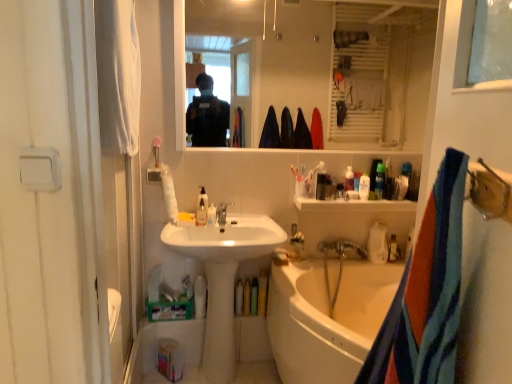
In order to face white glossy bathtub at lower center, should I rotate leftwards or rightwards?

You should rotate right by 15.749 degrees.

How much space does translucent plastic soap dispenser at sink, placed as the 1th bottle when sorted from front to back, occupy horizontally?

The width of translucent plastic soap dispenser at sink, placed as the 1th bottle when sorted from front to back, is 1.76 inches.

The width and height of the screenshot is (512, 384). What do you see at coordinates (170, 310) in the screenshot?
I see `green cardboard box at lower center` at bounding box center [170, 310].

This screenshot has height=384, width=512. What do you see at coordinates (326, 65) in the screenshot?
I see `clear glass mirror at upper center` at bounding box center [326, 65].

Identify the location of white matte bottle at lower right, which is the second bottle in left-to-right order. (377, 244).

Where is `white glossy bathtub at lower center`? This screenshot has height=384, width=512. white glossy bathtub at lower center is located at coordinates (327, 319).

From a real-world perspective, which object stands above the other?

From a 3D spatial view, translucent plastic bottle at upper center, which is the 3th toiletry in left-to-right order, is above.

From the image's perspective, is translucent plastic bottle at upper center, the 3th toiletry positioned from the right, under translucent plastic soap at lower right, the third bottle in the front-to-back sequence?

No.

This screenshot has height=384, width=512. What are the coordinates of `toiletry that is the 4th one when counting upward from the translucent plastic soap at lower right, the 1th bottle viewed from the right (from the image's perspective)` in the screenshot? It's located at (349, 179).

Can we say translucent plastic bottle at upper center, the 3th toiletry positioned from the right, lies outside translucent plastic soap at lower right, which is the 1th bottle in back-to-front order?

Yes, translucent plastic bottle at upper center, the 3th toiletry positioned from the right, is not within translucent plastic soap at lower right, which is the 1th bottle in back-to-front order.

Is the depth of translucent plastic cup at upper center, the fourth toiletry in the right-to-left sequence, less than that of translucent plastic soap dispenser at center, the 1th toiletry when ordered from left to right?

No.

Measure the distance from translucent plastic cup at upper center, arranged as the second toiletry when viewed from the left, to translucent plastic soap dispenser at center, the 1th toiletry when ordered from left to right.

translucent plastic cup at upper center, arranged as the second toiletry when viewed from the left, and translucent plastic soap dispenser at center, the 1th toiletry when ordered from left to right, are 59.94 centimeters apart from each other.

Is translucent plastic cup at upper center, arranged as the second toiletry when viewed from the left, not inside translucent plastic soap dispenser at center, which is the 5th toiletry from right to left?

translucent plastic cup at upper center, arranged as the second toiletry when viewed from the left, lies outside translucent plastic soap dispenser at center, which is the 5th toiletry from right to left,'s area.

Would you say translucent plastic cup at upper center, arranged as the second toiletry when viewed from the left, is to the left or to the right of translucent plastic soap dispenser at center, which is the 5th toiletry from right to left, in the picture?

In the image, translucent plastic cup at upper center, arranged as the second toiletry when viewed from the left, appears on the right side of translucent plastic soap dispenser at center, which is the 5th toiletry from right to left.

Is white fabric screen door at left positioned beyond the bounds of translucent plastic bottle at upper center, the 3th toiletry positioned from the right?

white fabric screen door at left lies outside translucent plastic bottle at upper center, the 3th toiletry positioned from the right,'s area.

Looking at this image, is white fabric screen door at left wider than translucent plastic bottle at upper center, which is the 3th toiletry in left-to-right order?

Yes, white fabric screen door at left is wider than translucent plastic bottle at upper center, which is the 3th toiletry in left-to-right order.

From the image's perspective, which toiletry is the 1st one above the white fabric screen door at left? Please provide its 2D coordinates.

[(349, 179)]

From a real-world perspective, who is located higher, white fabric screen door at left or translucent plastic bottle at upper center, the 3th toiletry positioned from the right?

In real-world perspective, white fabric screen door at left is above.

Considering the relative sizes of translucent plastic bottles at upper right, the 1th toiletry in the right-to-left sequence, and translucent plastic soap at lower right, the 1th bottle viewed from the right, in the image provided, is translucent plastic bottles at upper right, the 1th toiletry in the right-to-left sequence, taller than translucent plastic soap at lower right, the 1th bottle viewed from the right,?

Yes, translucent plastic bottles at upper right, the 1th toiletry in the right-to-left sequence, is taller than translucent plastic soap at lower right, the 1th bottle viewed from the right.

Is translucent plastic bottles at upper right, which appears as the fifth toiletry when viewed from the left, situated inside translucent plastic soap at lower right, which is the 3th bottle from left to right, or outside?

translucent plastic bottles at upper right, which appears as the fifth toiletry when viewed from the left, lies outside translucent plastic soap at lower right, which is the 3th bottle from left to right.

Is translucent plastic bottles at upper right, the 1th toiletry in the right-to-left sequence, next to translucent plastic soap at lower right, which is the 1th bottle in back-to-front order, and touching it?

No, translucent plastic bottles at upper right, the 1th toiletry in the right-to-left sequence, is not touching translucent plastic soap at lower right, which is the 1th bottle in back-to-front order.

Does translucent plastic bottles at upper right, which appears as the fifth toiletry when viewed from the left, appear on the right side of translucent plastic soap at lower right, the 1th bottle viewed from the right?

Incorrect, translucent plastic bottles at upper right, which appears as the fifth toiletry when viewed from the left, is not on the right side of translucent plastic soap at lower right, the 1th bottle viewed from the right.

Does white plastic shelf at upper center have a greater height compared to translucent plastic soap at lower right, which is the 1th bottle in back-to-front order?

No.

Based on the photo, considering the relative positions of white plastic shelf at upper center and translucent plastic soap at lower right, the 1th bottle viewed from the right, in the image provided, is white plastic shelf at upper center to the right of translucent plastic soap at lower right, the 1th bottle viewed from the right, from the viewer's perspective?

In fact, white plastic shelf at upper center is to the left of translucent plastic soap at lower right, the 1th bottle viewed from the right.

Where is `cabinetry that is above the translucent plastic soap at lower right, which is the 3th bottle from left to right (from the image's perspective)`? cabinetry that is above the translucent plastic soap at lower right, which is the 3th bottle from left to right (from the image's perspective) is located at coordinates (354, 205).

Is white plastic shelf at upper center bigger than translucent plastic soap at lower right, the 1th bottle viewed from the right?

Yes, white plastic shelf at upper center is bigger than translucent plastic soap at lower right, the 1th bottle viewed from the right.

From a real-world perspective, relative to white glossy faucet at center, is clear glass mirror at upper center vertically above or below?

From a real-world perspective, clear glass mirror at upper center is physically above white glossy faucet at center.

Based on the photo, is clear glass mirror at upper center oriented towards white glossy faucet at center?

No, clear glass mirror at upper center is not facing towards white glossy faucet at center.

Is clear glass mirror at upper center taller or shorter than white glossy faucet at center?

Clearly, clear glass mirror at upper center is taller compared to white glossy faucet at center.

What's the angular difference between white plastic shelf at upper center and blue striped towel at right, which appears as the 2th towel/napkin when viewed from the left,'s facing directions?

The angular difference between white plastic shelf at upper center and blue striped towel at right, which appears as the 2th towel/napkin when viewed from the left, is 101 degrees.

From the image's perspective, is white plastic shelf at upper center over blue striped towel at right, the 2th towel/napkin when ordered from back to front?

Yes, from the image's perspective, white plastic shelf at upper center is on top of blue striped towel at right, the 2th towel/napkin when ordered from back to front.

Is white plastic shelf at upper center not inside blue striped towel at right, the 2th towel/napkin when ordered from back to front?

Yes.

Would you consider white plastic shelf at upper center to be distant from blue striped towel at right, which appears as the 2th towel/napkin when viewed from the left?

That's right, there is a large distance between white plastic shelf at upper center and blue striped towel at right, which appears as the 2th towel/napkin when viewed from the left.

Locate an element on the screen. The height and width of the screenshot is (384, 512). the 2nd bottle behind the translucent plastic bottle at upper center, the 3th toiletry positioned from the right, counting from the anchor's position is located at coordinates tap(392, 249).

Where is `toiletry on the left of the translucent plastic cup at upper center, the fourth toiletry in the right-to-left sequence`? toiletry on the left of the translucent plastic cup at upper center, the fourth toiletry in the right-to-left sequence is located at coordinates (211, 214).

Based on their spatial positions, is white glossy faucet at center or white glossy sink at center closer to translucent plastic bottle at upper center, which is the 3th toiletry in left-to-right order?

white glossy faucet at center lies closer to translucent plastic bottle at upper center, which is the 3th toiletry in left-to-right order, than the other object.

Which object lies nearer to the anchor point white plastic bottle at upper center, arranged as the 2th toiletry when viewed from the right, green cardboard box at lower center or white fabric towel at left, which is counted as the 1th towel/napkin, starting from the top?

green cardboard box at lower center.

Based on their spatial positions, is white plastic shelf at upper center or translucent plastic soap at lower right, the 1th bottle viewed from the right, further from white fabric towel at left, which is counted as the 1th towel/napkin, starting from the top?

translucent plastic soap at lower right, the 1th bottle viewed from the right, is positioned further to the anchor white fabric towel at left, which is counted as the 1th towel/napkin, starting from the top.

When comparing their distances from white matte bottle at lower right, which ranks as the 2th bottle in right-to-left order, does translucent plastic bottle at upper center, the 3th toiletry positioned from the right, or green cardboard box at lower center seem closer?

The object closer to white matte bottle at lower right, which ranks as the 2th bottle in right-to-left order, is translucent plastic bottle at upper center, the 3th toiletry positioned from the right.

Estimate the real-world distances between objects in this image. Which object is further from white glossy sink at center, green cardboard box at lower center or white plastic shelf at upper center?

white plastic shelf at upper center.

Based on their spatial positions, is translucent plastic cup at upper center, arranged as the second toiletry when viewed from the left, or translucent plastic soap dispenser at center, the 1th toiletry when ordered from left to right, closer to white fabric towel at left, which ranks as the first towel/napkin in left-to-right order?

translucent plastic soap dispenser at center, the 1th toiletry when ordered from left to right, is closer to white fabric towel at left, which ranks as the first towel/napkin in left-to-right order.

Which object lies nearer to the anchor point white plastic bottle at upper center, arranged as the 2th toiletry when viewed from the right, white fabric towel at left, arranged as the 2th towel/napkin when ordered from the bottom, or translucent plastic soap dispenser at sink, marked as the first bottle in a left-to-right arrangement?

Based on the image, translucent plastic soap dispenser at sink, marked as the first bottle in a left-to-right arrangement, appears to be nearer to white plastic bottle at upper center, arranged as the 2th toiletry when viewed from the right.

Based on the photo, based on their spatial positions, is white glossy faucet at center or white fabric towel at left, arranged as the first towel/napkin when viewed from the back, further from clear glass mirror at upper center?

white fabric towel at left, arranged as the first towel/napkin when viewed from the back.

Locate an element on the screen. cabinetry located between translucent plastic cup at upper center, arranged as the second toiletry when viewed from the left, and translucent plastic soap at lower right, the 1th bottle viewed from the right, in the left-right direction is located at coordinates [x=354, y=205].

The image size is (512, 384). What are the coordinates of `sink between blue striped towel at right, the 2th towel/napkin when ordered from back to front, and translucent plastic soap dispenser at center, which is the 5th toiletry from right to left, along the z-axis` in the screenshot? It's located at (223, 277).

Where is `toiletry between translucent plastic soap dispenser at sink, placed as the 1th bottle when sorted from front to back, and green cardboard box at lower center vertically`? toiletry between translucent plastic soap dispenser at sink, placed as the 1th bottle when sorted from front to back, and green cardboard box at lower center vertically is located at coordinates (211, 214).

The image size is (512, 384). Identify the location of cabinetry located between translucent plastic soap dispenser at center, the 1th toiletry when ordered from left to right, and translucent plastic bottles at upper right, the 1th toiletry in the right-to-left sequence, in the left-right direction. (354, 205).